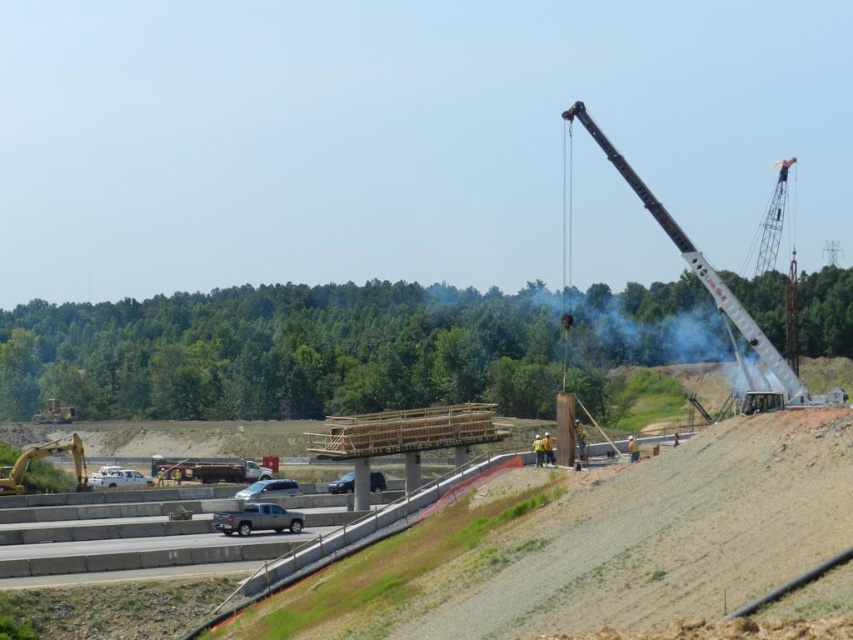
Can you confirm if silver metallic truck at lower center is positioned to the right of white matte van at lower left?

Yes, silver metallic truck at lower center is to the right of white matte van at lower left.

Can you confirm if silver metallic truck at lower center is positioned above white matte van at lower left?

Yes.

Describe the element at coordinates (257, 518) in the screenshot. This screenshot has height=640, width=853. I see `silver metallic truck at lower center` at that location.

Where is `silver metallic truck at lower center`? The width and height of the screenshot is (853, 640). silver metallic truck at lower center is located at coordinates (257, 518).

Does white matte van at lower left have a larger size compared to silver metallic car at center?

Correct, white matte van at lower left is larger in size than silver metallic car at center.

Between point (111, 476) and point (286, 483), which one is positioned in front?

Point (286, 483) is more forward.

I want to click on white matte van at lower left, so click(119, 477).

The height and width of the screenshot is (640, 853). What do you see at coordinates (41, 458) in the screenshot? I see `yellow metallic excavator at lower left` at bounding box center [41, 458].

Between point (68, 440) and point (263, 502), which one is positioned behind?

The point (68, 440) is more distant.

The image size is (853, 640). Identify the location of yellow metallic excavator at lower left. (41, 458).

This screenshot has height=640, width=853. Identify the location of yellow metallic excavator at lower left. (41, 458).